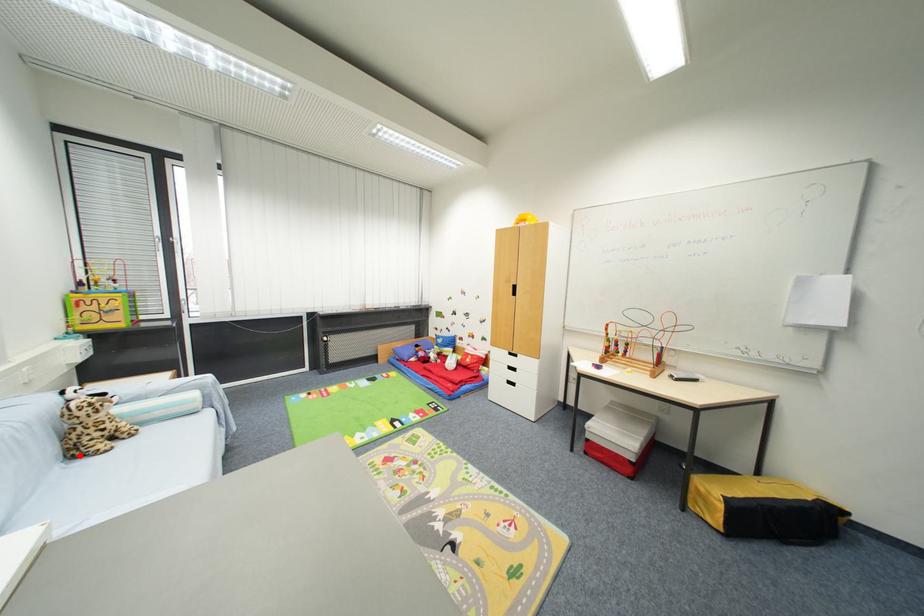
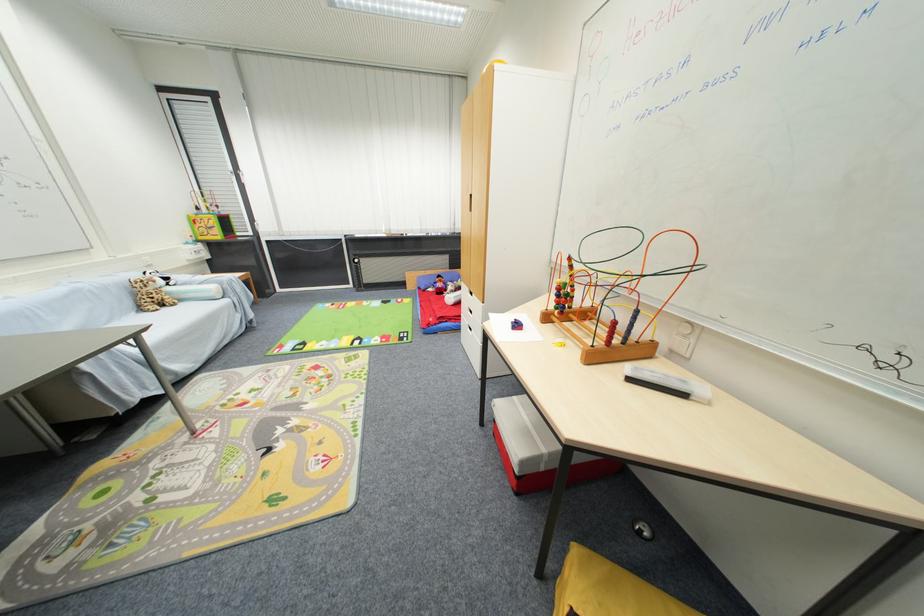
Find the pixel in the second image that matches the highlighted location in the first image.

(146, 310)